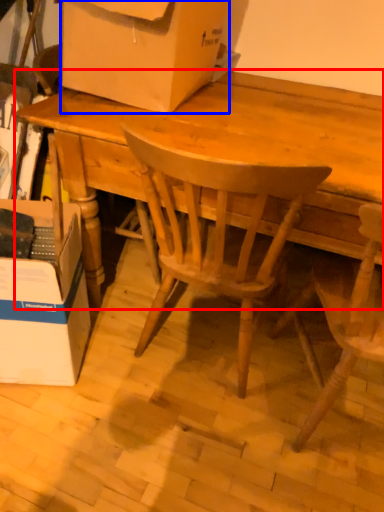
Question: Which of the following is the closest to the observer, desk (highlighted by a red box) or box (highlighted by a blue box)?

Choices:
 (A) desk
 (B) box

Answer: (A)